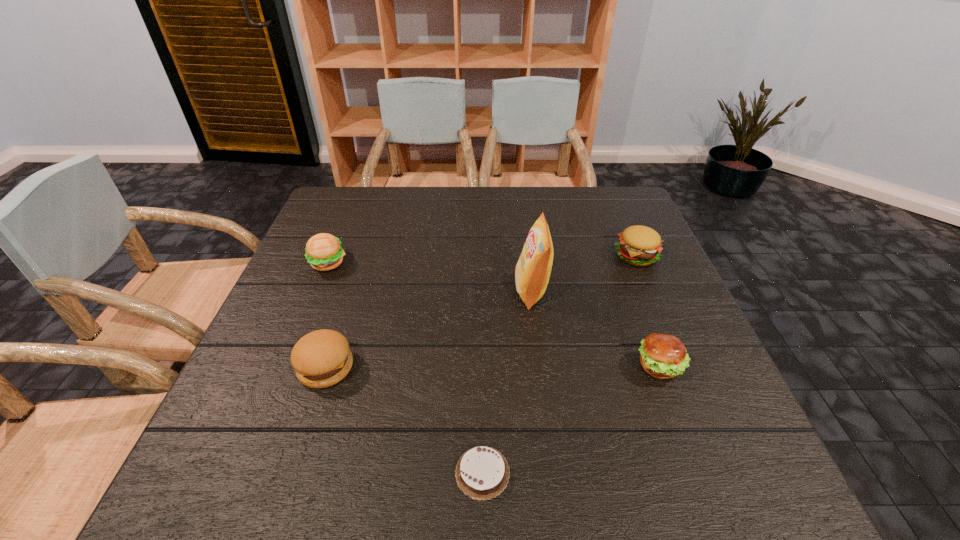
Identify which hamburger is located as the nearest to the third object from right to left. Please provide its 2D coordinates. Your answer should be formatted as a tuple, i.e. [(x, y)], where the tuple contains the x and y coordinates of a point satisfying the conditions above.

[(663, 356)]

Select which hamburger appears as the third closest to the third object from right to left. Please provide its 2D coordinates. Your answer should be formatted as a tuple, i.e. [(x, y)], where the tuple contains the x and y coordinates of a point satisfying the conditions above.

[(322, 358)]